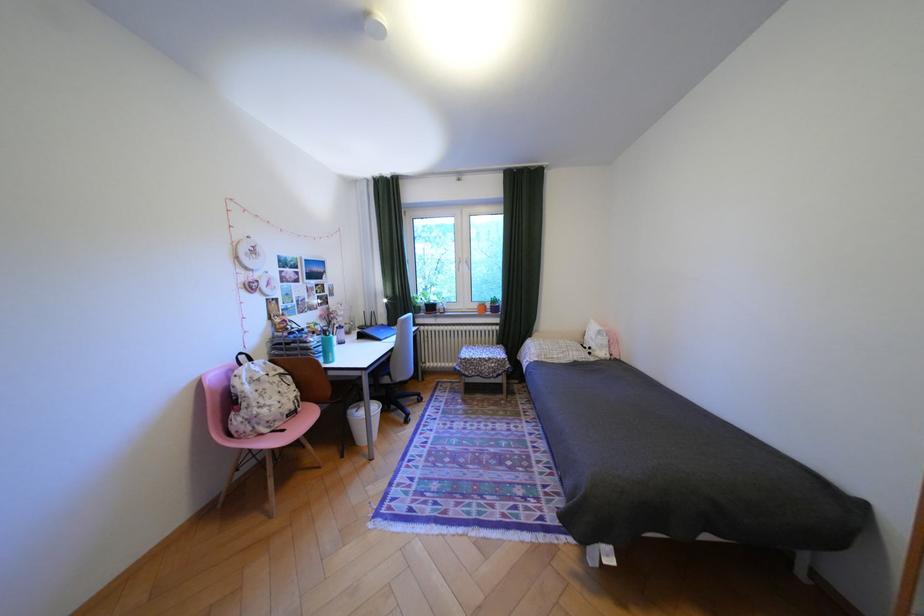
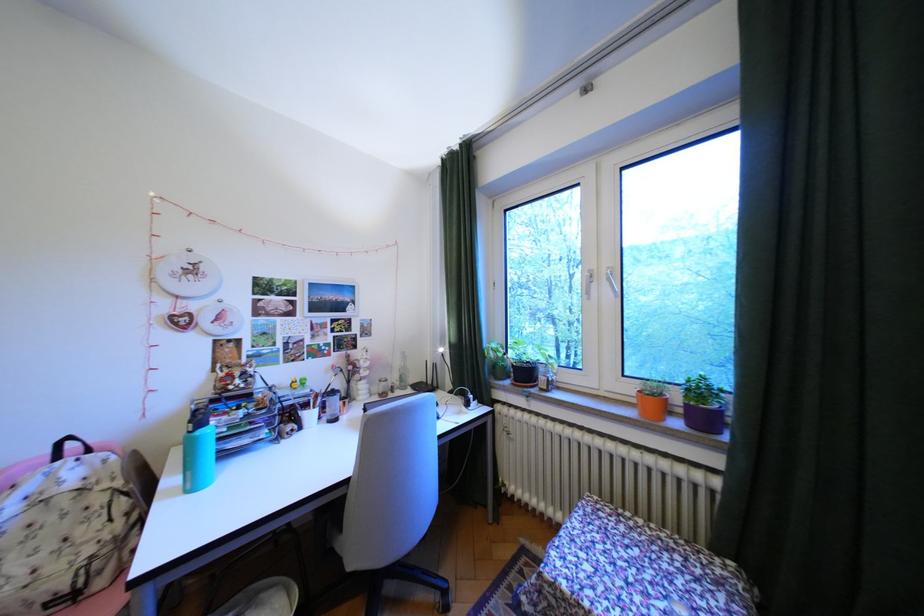
Find the pixel in the second image that matches the point at 280,386 in the first image.

(65, 519)